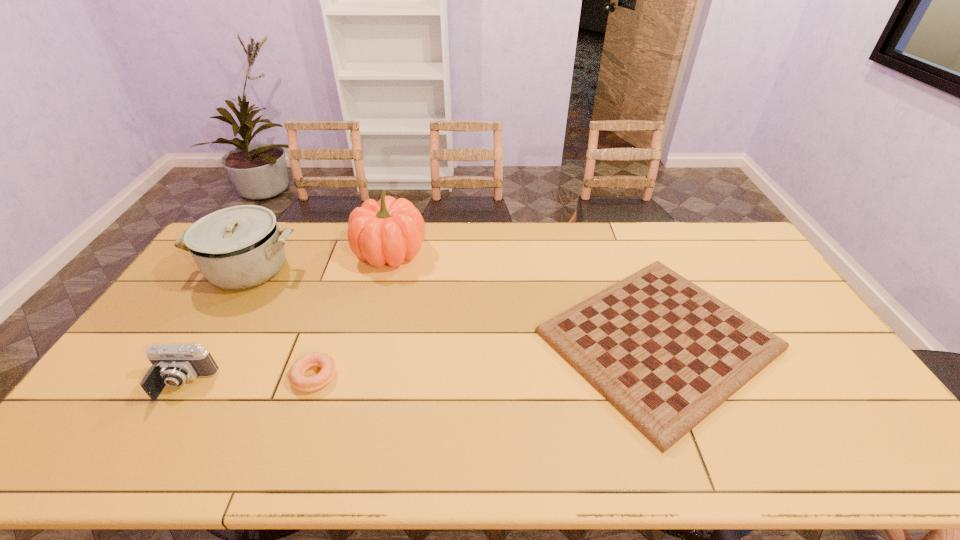
Locate an element on the screen. The height and width of the screenshot is (540, 960). pumpkin that is at the far edge is located at coordinates (391, 230).

Image resolution: width=960 pixels, height=540 pixels. In order to click on saucepan at the far edge in this screenshot , I will do `click(239, 247)`.

What are the coordinates of `object located at the near edge` in the screenshot? It's located at tap(665, 353).

Find the location of a particular element. The width and height of the screenshot is (960, 540). saucepan that is at the left edge is located at coordinates (239, 247).

The image size is (960, 540). I want to click on camera located at the left edge, so click(172, 364).

The image size is (960, 540). In order to click on object positioned at the right edge in this screenshot , I will do `click(665, 353)`.

Identify the location of object that is at the far left corner. This screenshot has width=960, height=540. (239, 247).

At what (x,y) coordinates should I click in order to perform the action: click on object located at the near right corner. Please return your answer as a coordinate pair (x, y). The height and width of the screenshot is (540, 960). Looking at the image, I should click on click(665, 353).

In the image, there is a desktop. At what (x,y) coordinates should I click in order to perform the action: click on free space at the far edge. Please return your answer as a coordinate pair (x, y). The width and height of the screenshot is (960, 540). Looking at the image, I should click on (654, 251).

The height and width of the screenshot is (540, 960). I want to click on vacant region at the near edge of the desktop, so click(x=582, y=449).